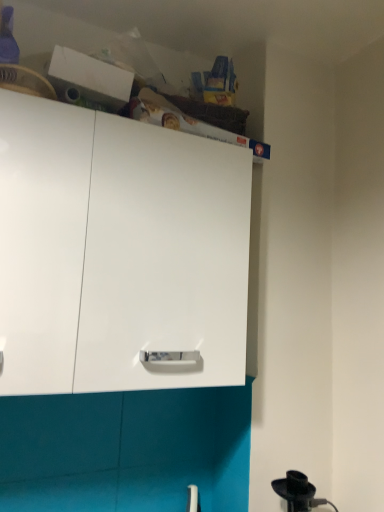
The height and width of the screenshot is (512, 384). What do you see at coordinates (118, 252) in the screenshot?
I see `white glossy cabinet at upper left` at bounding box center [118, 252].

At what (x,y) coordinates should I click in order to perform the action: click on white glossy cabinet at upper left. Please return your answer as a coordinate pair (x, y). The image size is (384, 512). Looking at the image, I should click on (118, 252).

Locate an element on the screen. white glossy cabinet at upper left is located at coordinates (118, 252).